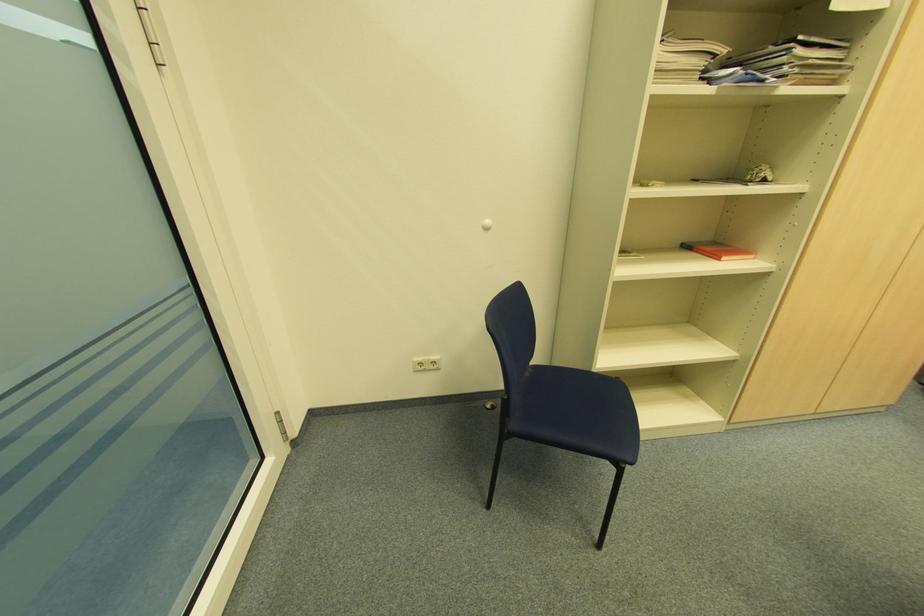
Image resolution: width=924 pixels, height=616 pixels. Identify the location of blue chair sitting surface. (578, 395).